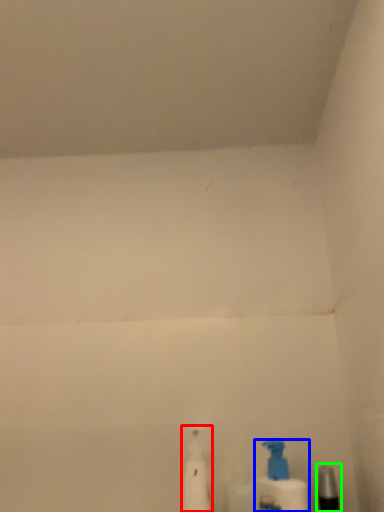
Question: Based on their relative distances, which object is farther from cleaning product (highlighted by a red box)? Choose from bottle (highlighted by a blue box) and toiletry (highlighted by a green box).

Choices:
 (A) bottle
 (B) toiletry

Answer: (B)